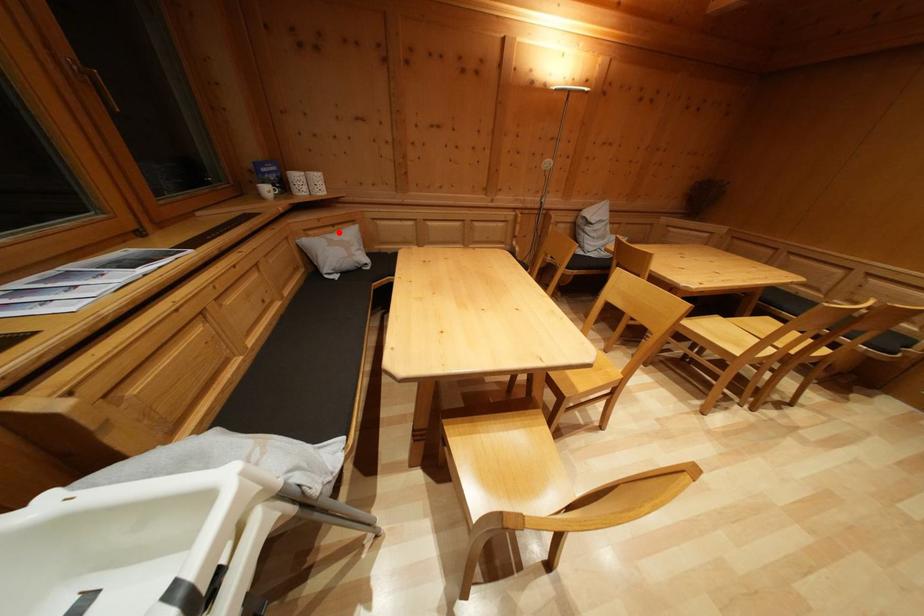
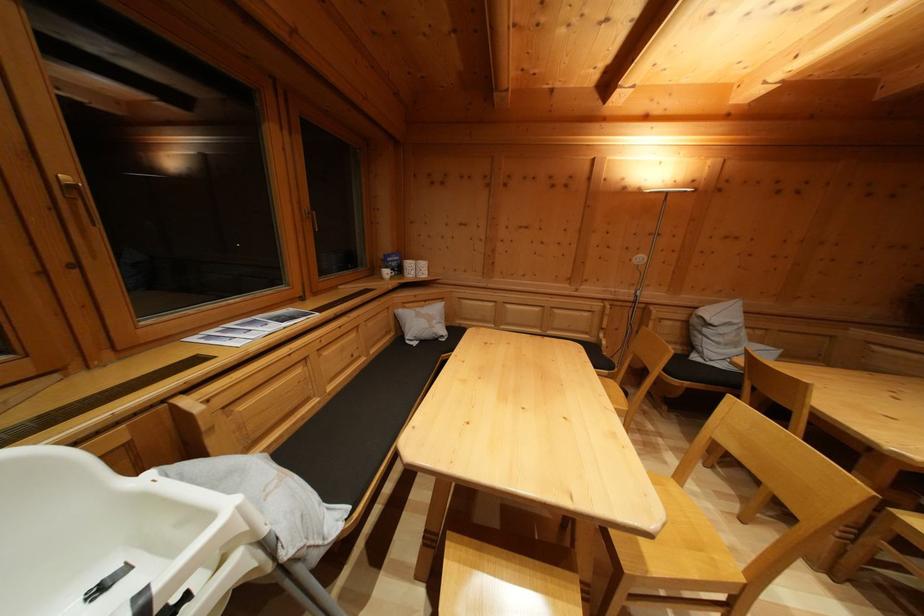
Question: I am providing you with two images of the same scene from different viewpoints. Given a red point in image1, look at the same physical point in image2. Is it:

Choices:
 (A) Closer to the viewpoint
 (B) Farther from the viewpoint

Answer: (B)